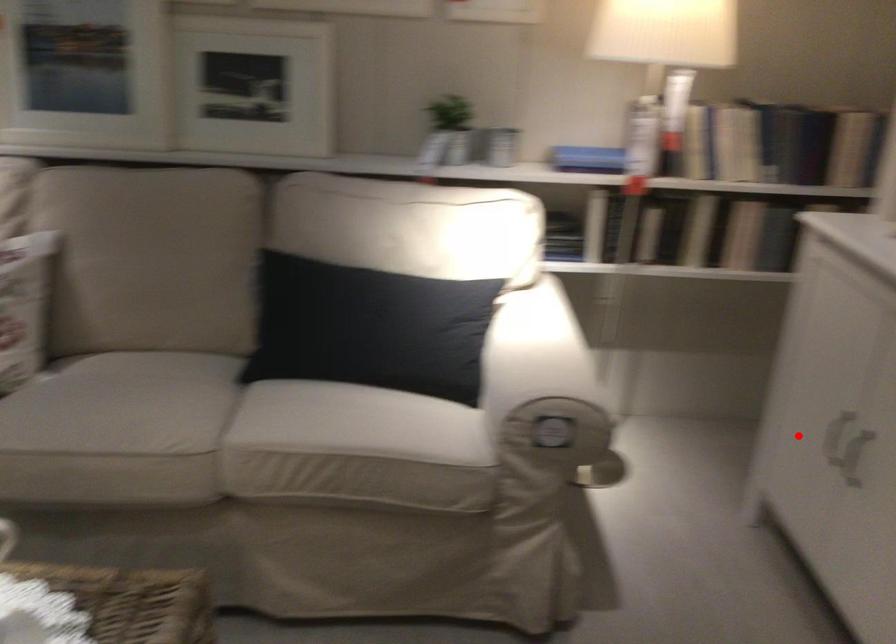
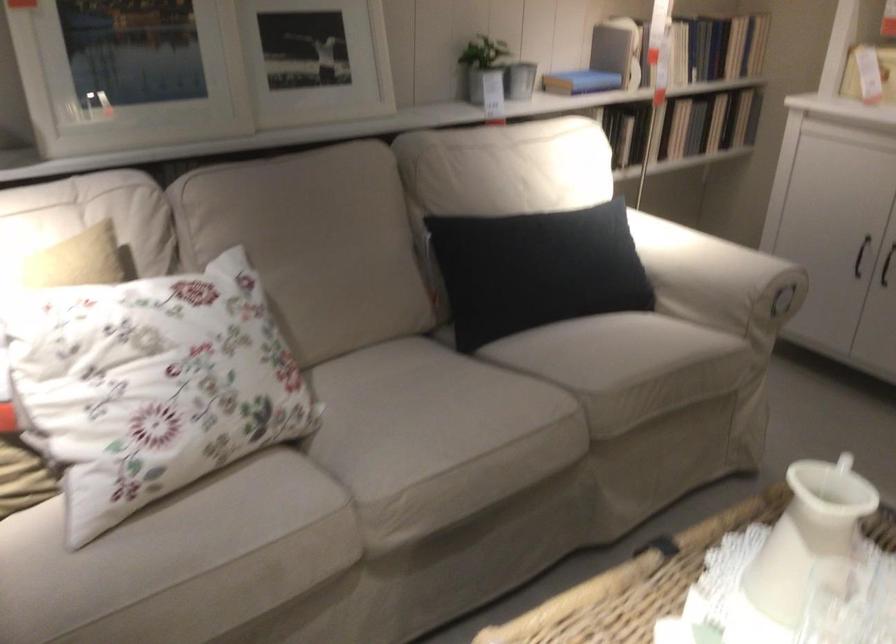
Question: I am providing you with two images of the same scene from different viewpoints. A red point is marked on the first image. Is the red point's position out of view in image 2?

Choices:
 (A) Yes
 (B) No

Answer: (B)